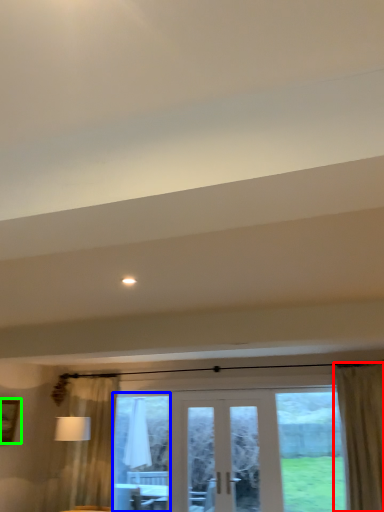
Question: Estimate the real-world distances between objects in this image. Which object is closer to curtain (highlighted by a red box), window screen (highlighted by a blue box) or picture frame (highlighted by a green box)?

Choices:
 (A) window screen
 (B) picture frame

Answer: (A)